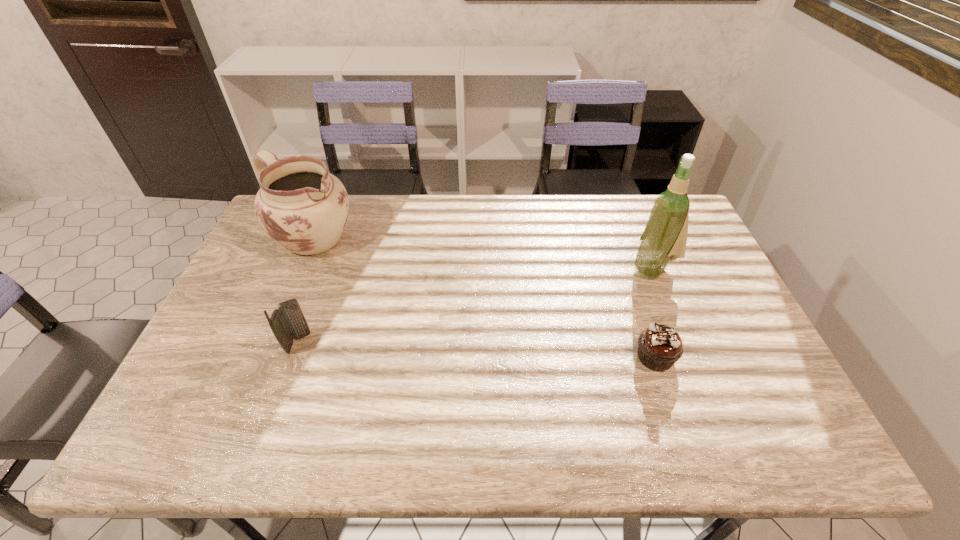
Locate an element on the screen. The height and width of the screenshot is (540, 960). empty location between the second tallest object and the cupcake is located at coordinates (483, 298).

Locate an element on the screen. empty space that is in between the tallest object and the shortest object is located at coordinates (653, 313).

The image size is (960, 540). Find the location of `vacant space that's between the pitcher and the shortest object`. vacant space that's between the pitcher and the shortest object is located at coordinates (483, 298).

I want to click on free area in between the cellular telephone and the shortest object, so click(477, 350).

Where is `free space between the third tallest object and the shortest object`? The width and height of the screenshot is (960, 540). free space between the third tallest object and the shortest object is located at coordinates (477, 350).

You are a GUI agent. You are given a task and a screenshot of the screen. Output one action in this format:
    pyautogui.click(x=<x>, y=<y>)
    Task: Click on the vacant area that lies between the shortest object and the wine bottle
    This screenshot has width=960, height=540.
    Given the screenshot: What is the action you would take?
    pyautogui.click(x=653, y=313)

I want to click on free space between the cupcake and the pitcher, so click(483, 298).

The width and height of the screenshot is (960, 540). Identify the location of vacant space in between the wine bottle and the pitcher. (481, 253).

This screenshot has height=540, width=960. Identify the location of vacant space that's between the second tallest object and the cellular telephone. (305, 291).

You are a GUI agent. You are given a task and a screenshot of the screen. Output one action in this format:
    pyautogui.click(x=<x>, y=<y>)
    Task: Click on the free space between the shortest object and the pitcher
    This screenshot has height=540, width=960.
    Given the screenshot: What is the action you would take?
    pyautogui.click(x=483, y=298)